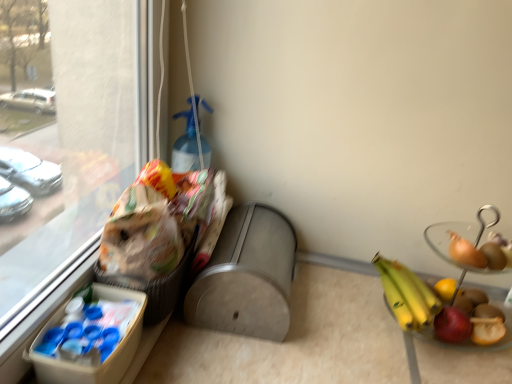
Question: Does white plastic lunch box at lower left have a greater height compared to plastic woven basket at left?

Choices:
 (A) yes
 (B) no

Answer: (B)

Question: Is white plastic lunch box at lower left positioned beyond the bounds of plastic woven basket at left?

Choices:
 (A) no
 (B) yes

Answer: (B)

Question: Would you say white plastic lunch box at lower left is a long distance from plastic woven basket at left?

Choices:
 (A) yes
 (B) no

Answer: (B)

Question: Does white plastic lunch box at lower left appear on the left side of plastic woven basket at left?

Choices:
 (A) no
 (B) yes

Answer: (B)

Question: Is white plastic lunch box at lower left with plastic woven basket at left?

Choices:
 (A) no
 (B) yes

Answer: (B)

Question: Considering the relative sizes of white plastic lunch box at lower left and plastic woven basket at left in the image provided, is white plastic lunch box at lower left thinner than plastic woven basket at left?

Choices:
 (A) no
 (B) yes

Answer: (B)

Question: Does plastic woven basket at left have a smaller size compared to white plastic lunch box at lower left?

Choices:
 (A) yes
 (B) no

Answer: (B)

Question: Is plastic woven basket at left in front of white plastic lunch box at lower left?

Choices:
 (A) no
 (B) yes

Answer: (A)

Question: From a real-world perspective, does plastic woven basket at left sit lower than white plastic lunch box at lower left?

Choices:
 (A) no
 (B) yes

Answer: (A)

Question: Does plastic woven basket at left have a larger size compared to white plastic lunch box at lower left?

Choices:
 (A) no
 (B) yes

Answer: (B)

Question: Can you confirm if plastic woven basket at left is positioned to the left of white plastic lunch box at lower left?

Choices:
 (A) yes
 (B) no

Answer: (B)

Question: Is white plastic lunch box at lower left at the back of plastic woven basket at left?

Choices:
 (A) yes
 (B) no

Answer: (B)

Question: In terms of width, does plastic woven basket at left look wider or thinner when compared to white plastic lunch box at lower left?

Choices:
 (A) thin
 (B) wide

Answer: (B)